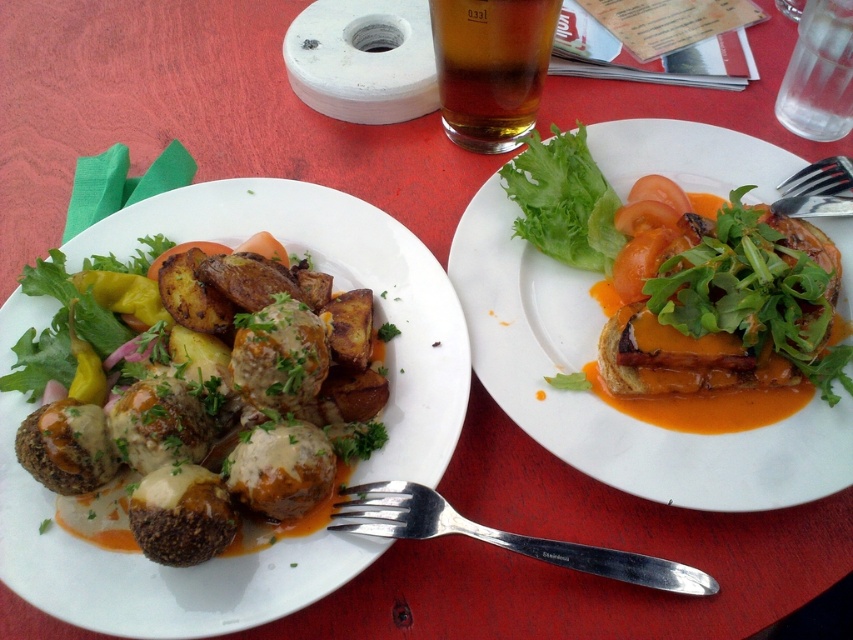
Question: Which point appears closest to the camera in this image?

Choices:
 (A) (399, 504)
 (B) (697, 451)
 (C) (537, 163)

Answer: (A)

Question: Does brown matte meatballs at left appear on the right side of matte white plate at center?

Choices:
 (A) yes
 (B) no

Answer: (B)

Question: Which of the following is the closest to the observer?

Choices:
 (A) matte white plate at center
 (B) silver metallic fork at lower left
 (C) green leafy lettuce at upper right

Answer: (B)

Question: Can you confirm if green leafy lettuce at upper right is smaller than silver metallic fork at upper right?

Choices:
 (A) no
 (B) yes

Answer: (A)

Question: Which point is closer to the camera?

Choices:
 (A) brown matte meatballs at left
 (B) green leafy lettuce at upper right
 (C) brown translucent glass at upper center
 (D) silver metallic fork at lower left

Answer: (A)

Question: Can you confirm if matte white plate at center is positioned to the right of brown translucent glass at upper center?

Choices:
 (A) yes
 (B) no

Answer: (A)